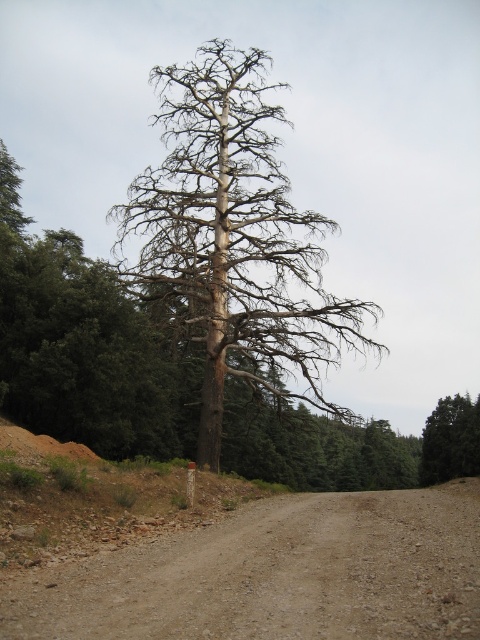
You are a hiker trying to reach a cabin located behind the bare wood tree at center. The brown gravel dirt track at center is the only path available. Can you walk around the tree using the path to reach the cabin?

The brown gravel dirt track at center is in front of the bare wood tree at center, so the path is not behind the tree. Therefore, you cannot reach the cabin behind the tree by using the path.